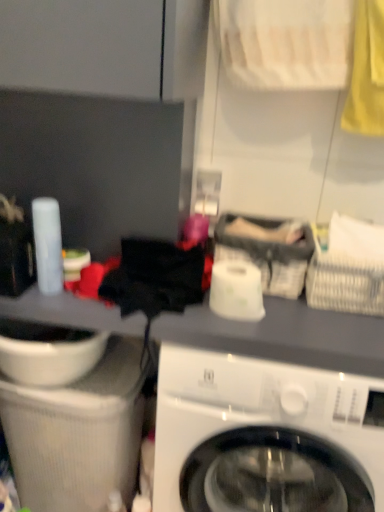
Find the location of `free space above white glossy sink at lower left (from a real-world perspective)`. free space above white glossy sink at lower left (from a real-world perspective) is located at coordinates (82, 372).